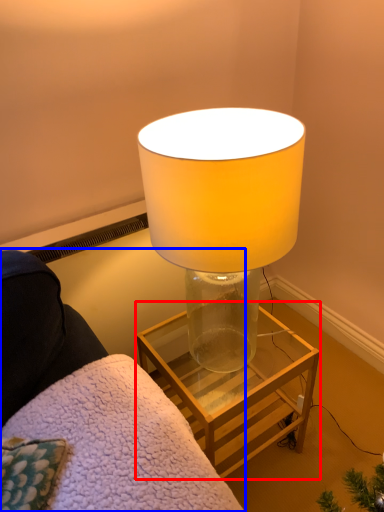
Question: Which object appears farthest to the camera in this image, table (highlighted by a red box) or furniture (highlighted by a blue box)?

Choices:
 (A) table
 (B) furniture

Answer: (A)